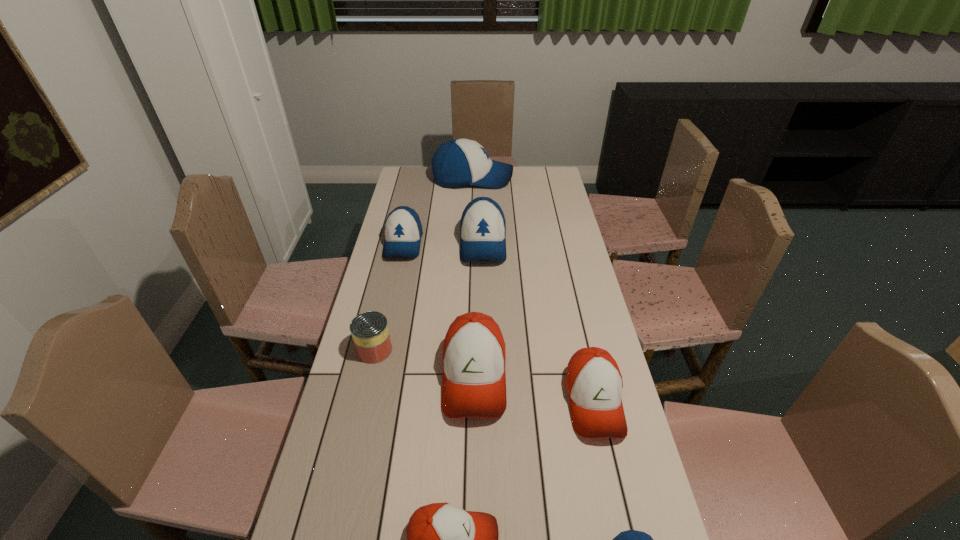
The height and width of the screenshot is (540, 960). What are the coordinates of `the farthest object` in the screenshot? It's located at (459, 162).

This screenshot has height=540, width=960. Find the location of `the biggest blue baseball cap`. the biggest blue baseball cap is located at coordinates (459, 162).

Where is `the third smallest blue baseball cap`? This screenshot has height=540, width=960. the third smallest blue baseball cap is located at coordinates (482, 226).

Locate an element on the screen. This screenshot has height=540, width=960. the biggest orange baseball cap is located at coordinates (474, 380).

Where is `the third biggest blue baseball cap`? Image resolution: width=960 pixels, height=540 pixels. the third biggest blue baseball cap is located at coordinates (403, 230).

Locate an element on the screen. Image resolution: width=960 pixels, height=540 pixels. the second smallest orange baseball cap is located at coordinates (594, 384).

Identify the location of can. This screenshot has width=960, height=540. (369, 330).

Locate an element on the screen. vacant space positioned on the front-facing side of the tallest baseball cap is located at coordinates (540, 179).

At what (x,y) coordinates should I click in order to perform the action: click on vacant region located on the front-facing side of the second biggest blue baseball cap. Please return your answer as a coordinate pair (x, y). This screenshot has width=960, height=540. Looking at the image, I should click on (484, 316).

In order to click on vacant region located on the front-facing side of the biggest orange baseball cap in this screenshot , I will do `click(473, 481)`.